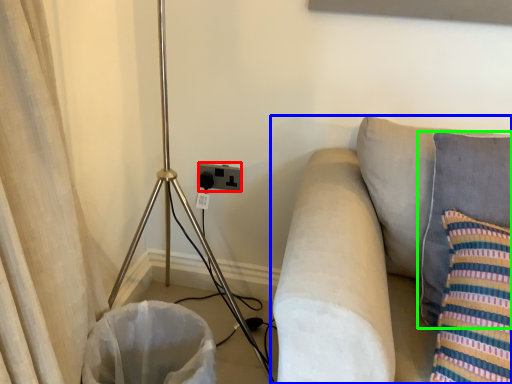
Question: Based on their relative distances, which object is nearer to electric outlet (highlighted by a red box)? Choose from studio couch (highlighted by a blue box) and pillow (highlighted by a green box).

Choices:
 (A) studio couch
 (B) pillow

Answer: (A)